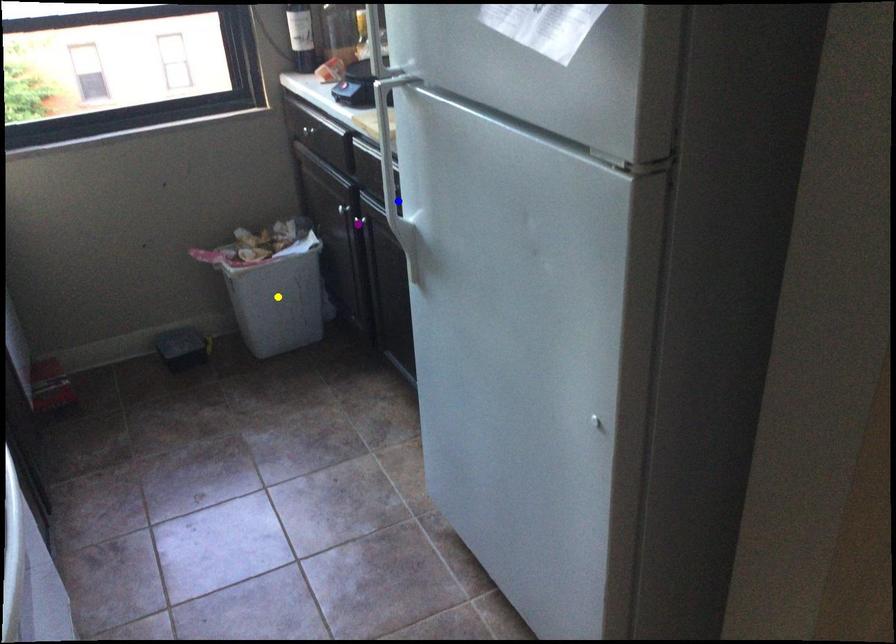
Order these from nearest to farthest:
A) yellow point
B) purple point
C) blue point

1. blue point
2. purple point
3. yellow point